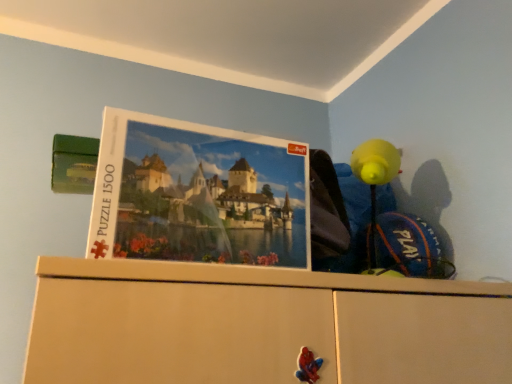
What do you see at coordinates (197, 194) in the screenshot? The width and height of the screenshot is (512, 384). I see `matte cardboard puzzle at upper center` at bounding box center [197, 194].

In order to face matte cardboard puzzle at upper center, should I rotate leftwards or rightwards?

To face it directly, rotate left by 6.671 degrees.

Locate an element on the screen. This screenshot has width=512, height=384. matte cardboard puzzle at upper center is located at coordinates (197, 194).

Find the location of a particular element. The width and height of the screenshot is (512, 384). matte cardboard puzzle at upper center is located at coordinates (x=197, y=194).